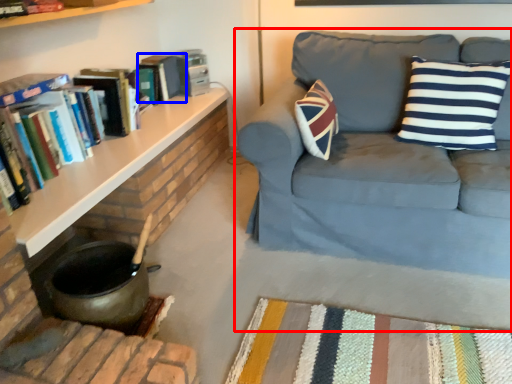
Question: Which object is further to the camera taking this photo, studio couch (highlighted by a red box) or paperback book (highlighted by a blue box)?

Choices:
 (A) studio couch
 (B) paperback book

Answer: (B)